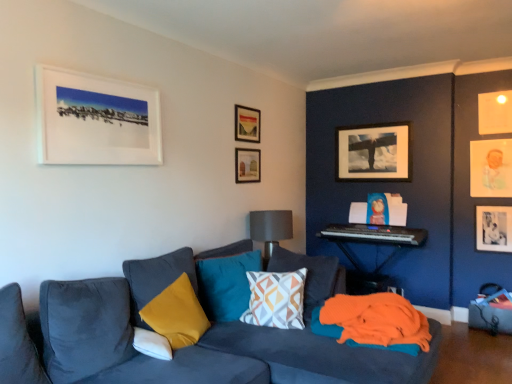
You are a GUI agent. You are given a task and a screenshot of the screen. Output one action in this format:
    pyautogui.click(x=<x>, y=<y>)
    Task: Click on the blank space situated above white matte picture frame at upper left, which ranks as the first picture frame in front-to-back order (from a real-world perspective)
    This screenshot has width=512, height=384.
    Given the screenshot: What is the action you would take?
    pyautogui.click(x=99, y=78)